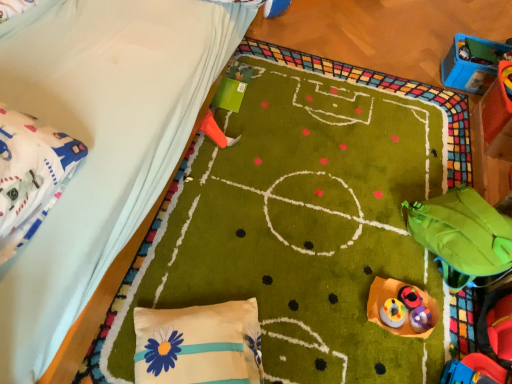
Question: From a real-world perspective, relative to matte plastic toy at lower right, marked as the 2th toy in a bottom-to-top arrangement, is rubberized plastic toy at lower right, the 1th toy when ordered from bottom to top, vertically above or below?

Choices:
 (A) below
 (B) above

Answer: (A)

Question: Is rubberized plastic toy at lower right, positioned as the fifth toy in left-to-right order, situated inside matte plastic toy at lower right, the 6th toy from the back, or outside?

Choices:
 (A) outside
 (B) inside

Answer: (B)

Question: Considering the real-world distances, which object is farthest from the rubberized yellow toy at center, which is the fourth toy in top-to-bottom order?

Choices:
 (A) blue plastic toy at upper right, the 1th toy when ordered from back to front
 (B) orange plastic cone at upper center, positioned as the 5th toy in bottom-to-top order
 (C) white fabric at left
 (D) green fabric bean bag at lower right
 (E) rubberized plastic toy at lower right, the 1th toy when ordered from bottom to top

Answer: (A)

Question: Estimate the real-world distances between objects in this image. Which object is farther from the matte plastic toy at lower right, the 6th toy from the back?

Choices:
 (A) rubberized yellow toy at center, arranged as the second toy when viewed from the left
 (B) white satin pillow with blue flower at lower center
 (C) rubberized plastic toy at center, placed as the fourth toy when sorted from bottom to top
 (D) orange plastic cone at upper center, which is the fifth toy from front to back
 (E) rubberized plastic toy at lower right, which is counted as the 6th toy, starting from the top

Answer: (D)